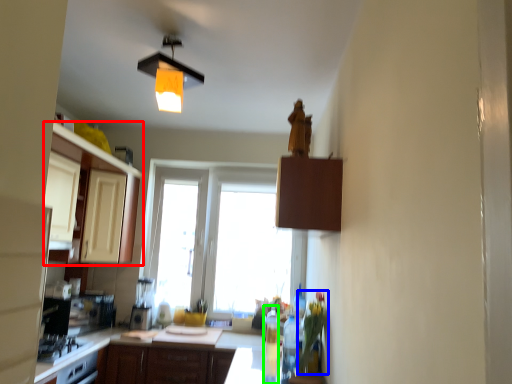
Question: Which object is positioned closest to cabinetry (highlighted by a red box)? Select from flower (highlighted by a blue box) and bottle (highlighted by a green box).

Choices:
 (A) flower
 (B) bottle

Answer: (B)